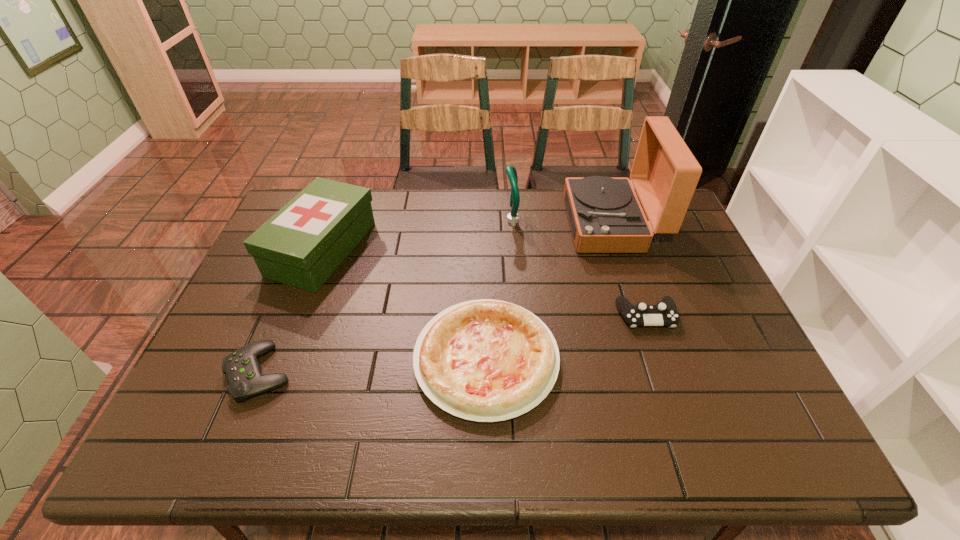
Where is `free spot between the pizza and the taller control`? The width and height of the screenshot is (960, 540). free spot between the pizza and the taller control is located at coordinates (566, 338).

Select which object appears as the closest to the phonograph record. Please provide its 2D coordinates. Your answer should be formatted as a tuple, i.e. [(x, y)], where the tuple contains the x and y coordinates of a point satisfying the conditions above.

[(510, 170)]

Point out which object is positioned as the second nearest to the tallest object. Please provide its 2D coordinates. Your answer should be formatted as a tuple, i.e. [(x, y)], where the tuple contains the x and y coordinates of a point satisfying the conditions above.

[(665, 313)]

The width and height of the screenshot is (960, 540). Identify the location of vacant space that satisfies the following two spatial constraints: 1. at the jaws of the second tallest object; 2. on the front side of the shortest object. (522, 373).

Find the location of `vacant area that satisfies the following two spatial constraints: 1. on the back side of the pizza; 2. on the left side of the left control`. vacant area that satisfies the following two spatial constraints: 1. on the back side of the pizza; 2. on the left side of the left control is located at coordinates (265, 359).